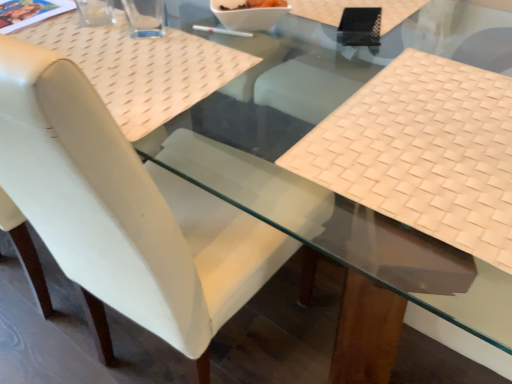
Identify the location of free point to the right of transparent glass cup at upper left, marked as the 1th clear in a left-to-right arrangement. (147, 19).